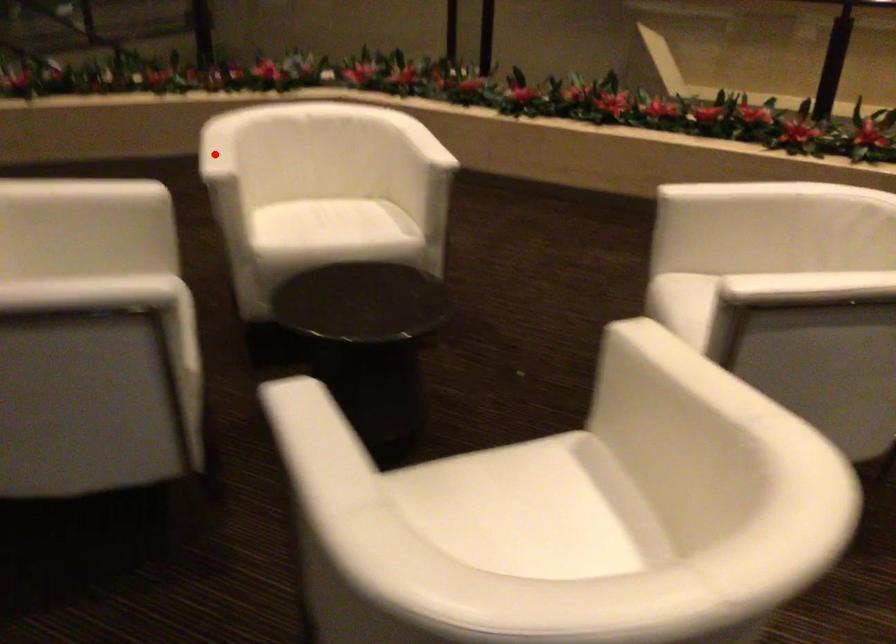
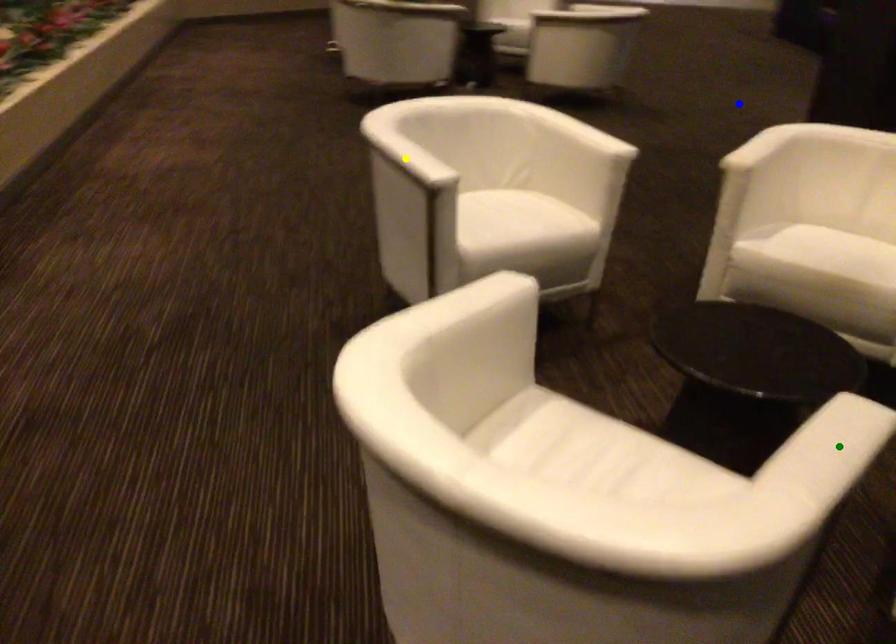
Question: I am providing you with two images of the same scene from different viewpoints. A red point is marked on the first image. You are given multiple points on the second image. In image 2, which mark is for the same physical point as the one in image 1?

Choices:
 (A) green point
 (B) blue point
 (C) yellow point

Answer: (A)